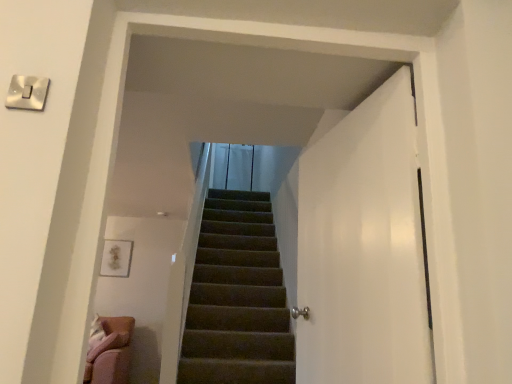
Question: Can you confirm if white glossy door at right is bigger than white glossy switch at upper left?

Choices:
 (A) yes
 (B) no

Answer: (A)

Question: From a real-world perspective, is white glossy door at right positioned under white glossy switch at upper left based on gravity?

Choices:
 (A) no
 (B) yes

Answer: (B)

Question: Is white glossy door at right completely or partially outside of white glossy switch at upper left?

Choices:
 (A) yes
 (B) no

Answer: (A)

Question: Is white glossy door at right positioned with its back to white glossy switch at upper left?

Choices:
 (A) no
 (B) yes

Answer: (A)

Question: Considering the relative sizes of white glossy door at right and white glossy switch at upper left in the image provided, is white glossy door at right taller than white glossy switch at upper left?

Choices:
 (A) no
 (B) yes

Answer: (B)

Question: From a real-world perspective, does white glossy door at right stand above white glossy switch at upper left?

Choices:
 (A) no
 (B) yes

Answer: (A)

Question: Is white glossy switch at upper left located outside white glossy door at right?

Choices:
 (A) yes
 (B) no

Answer: (A)

Question: Does white glossy switch at upper left contain white glossy door at right?

Choices:
 (A) yes
 (B) no

Answer: (B)

Question: From the image's perspective, is white glossy switch at upper left below white glossy door at right?

Choices:
 (A) no
 (B) yes

Answer: (A)

Question: From the image's perspective, does white glossy switch at upper left appear higher than white glossy door at right?

Choices:
 (A) yes
 (B) no

Answer: (A)

Question: Can you confirm if white glossy switch at upper left is positioned to the left of white glossy door at right?

Choices:
 (A) yes
 (B) no

Answer: (A)

Question: Is white glossy switch at upper left far from white glossy door at right?

Choices:
 (A) yes
 (B) no

Answer: (A)

Question: Would you say white glossy door at right is to the left or to the right of white glossy switch at upper left in the picture?

Choices:
 (A) right
 (B) left

Answer: (A)